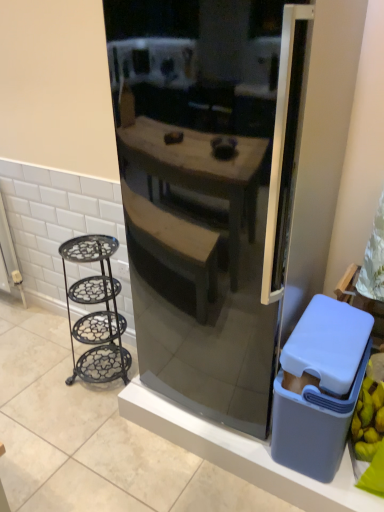
Question: Considering the relative sizes of black wrought iron stand at left and gray plastic trash bin at right in the image provided, is black wrought iron stand at left smaller than gray plastic trash bin at right?

Choices:
 (A) yes
 (B) no

Answer: (B)

Question: Is black wrought iron stand at left not inside gray plastic trash bin at right?

Choices:
 (A) yes
 (B) no

Answer: (A)

Question: Is black wrought iron stand at left thinner than gray plastic trash bin at right?

Choices:
 (A) no
 (B) yes

Answer: (B)

Question: From a real-world perspective, is black wrought iron stand at left positioned over gray plastic trash bin at right based on gravity?

Choices:
 (A) no
 (B) yes

Answer: (A)

Question: Is black wrought iron stand at left at the left side of gray plastic trash bin at right?

Choices:
 (A) yes
 (B) no

Answer: (A)

Question: Is point (114, 100) positioned closer to the camera than point (276, 389)?

Choices:
 (A) closer
 (B) farther

Answer: (A)

Question: In terms of size, does satin black refrigerator at center appear bigger or smaller than gray plastic trash bin at right?

Choices:
 (A) small
 (B) big

Answer: (B)

Question: Considering the positions of satin black refrigerator at center and gray plastic trash bin at right in the image, is satin black refrigerator at center taller or shorter than gray plastic trash bin at right?

Choices:
 (A) short
 (B) tall

Answer: (B)

Question: In terms of width, does satin black refrigerator at center look wider or thinner when compared to gray plastic trash bin at right?

Choices:
 (A) wide
 (B) thin

Answer: (A)

Question: Visually, is satin black refrigerator at center positioned to the left or to the right of black wrought iron stand at left?

Choices:
 (A) right
 (B) left

Answer: (A)

Question: Is satin black refrigerator at center inside the boundaries of black wrought iron stand at left, or outside?

Choices:
 (A) inside
 (B) outside

Answer: (B)

Question: Is point (251, 163) closer or farther from the camera than point (81, 303)?

Choices:
 (A) farther
 (B) closer

Answer: (B)

Question: From a real-world perspective, is satin black refrigerator at center above or below black wrought iron stand at left?

Choices:
 (A) below
 (B) above

Answer: (B)

Question: In the image, is black wrought iron stand at left positioned in front of or behind gray plastic trash bin at right?

Choices:
 (A) behind
 (B) front

Answer: (A)

Question: In terms of width, does black wrought iron stand at left look wider or thinner when compared to gray plastic trash bin at right?

Choices:
 (A) thin
 (B) wide

Answer: (A)